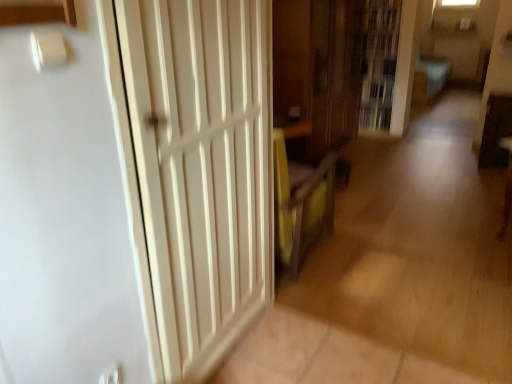
Question: Considering the relative positions of white wood door at left and hardcover book at center, the 2th book positioned from the top, in the image provided, is white wood door at left to the right of hardcover book at center, the 2th book positioned from the top, from the viewer's perspective?

Choices:
 (A) yes
 (B) no

Answer: (B)

Question: Considering the relative positions of white wood door at left and hardcover book at center, the 2th book positioned from the top, in the image provided, is white wood door at left in front of hardcover book at center, the 2th book positioned from the top,?

Choices:
 (A) no
 (B) yes

Answer: (B)

Question: Considering the relative sizes of white wood door at left and hardcover book at center, the 1th book when ordered from bottom to top, in the image provided, is white wood door at left bigger than hardcover book at center, the 1th book when ordered from bottom to top,?

Choices:
 (A) yes
 (B) no

Answer: (A)

Question: Does white wood door at left appear on the left side of hardcover book at center, the 1th book when ordered from bottom to top?

Choices:
 (A) no
 (B) yes

Answer: (B)

Question: Is white wood door at left shorter than hardcover book at center, the 1th book when ordered from bottom to top?

Choices:
 (A) yes
 (B) no

Answer: (B)

Question: In terms of height, does wooden bookcase at upper right look taller or shorter compared to wooden cabinet at center?

Choices:
 (A) tall
 (B) short

Answer: (B)

Question: Is wooden bookcase at upper right inside or outside of wooden cabinet at center?

Choices:
 (A) outside
 (B) inside

Answer: (A)

Question: Is wooden bookcase at upper right wider or thinner than wooden cabinet at center?

Choices:
 (A) thin
 (B) wide

Answer: (A)

Question: From the image's perspective, relative to wooden cabinet at center, is wooden bookcase at upper right above or below?

Choices:
 (A) below
 (B) above

Answer: (B)

Question: From the image's perspective, is wooden bookcase at upper right positioned above or below white wood door at left?

Choices:
 (A) below
 (B) above

Answer: (B)

Question: Relative to white wood door at left, is wooden bookcase at upper right in front or behind?

Choices:
 (A) front
 (B) behind

Answer: (B)

Question: Considering the positions of wooden bookcase at upper right and white wood door at left in the image, is wooden bookcase at upper right taller or shorter than white wood door at left?

Choices:
 (A) short
 (B) tall

Answer: (B)

Question: In terms of width, does wooden bookcase at upper right look wider or thinner when compared to white wood door at left?

Choices:
 (A) thin
 (B) wide

Answer: (B)

Question: Considering their positions, is white wood door at left located in front of or behind wooden bookcase at upper right?

Choices:
 (A) behind
 (B) front

Answer: (B)

Question: Would you say white wood door at left is inside or outside wooden bookcase at upper right?

Choices:
 (A) inside
 (B) outside

Answer: (B)